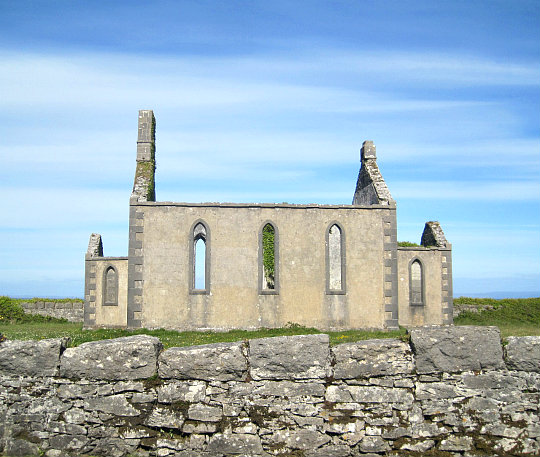
Where is `window`? This screenshot has width=540, height=457. window is located at coordinates (111, 289), (195, 258), (266, 255), (335, 259), (418, 281).